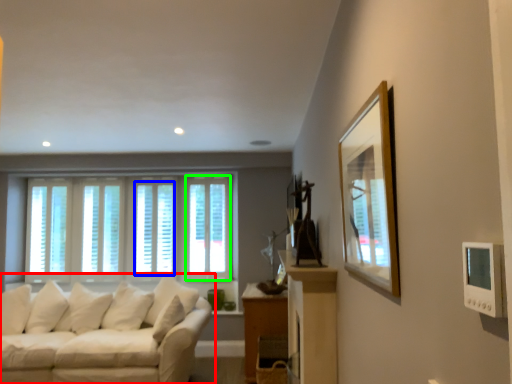
Question: Considering the real-world distances, which object is farthest from studio couch (highlighted by a red box)? window (highlighted by a blue box) or window (highlighted by a green box)?

Choices:
 (A) window
 (B) window

Answer: (B)